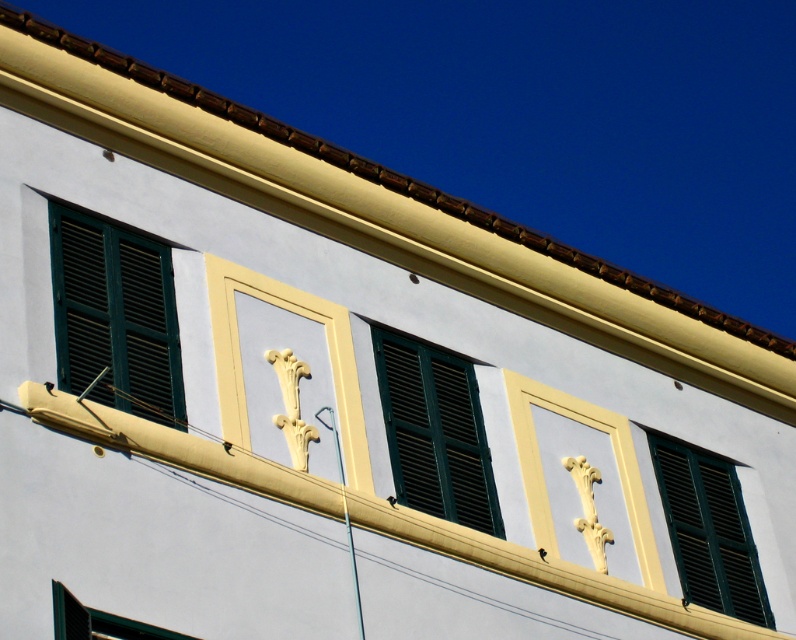
You are an architect designing a similar building facade. You have two green matte shutters at left and green matte shutters at center. Which one has a smaller width?

The green matte shutters at left has a smaller width than the green matte shutters at center.

You are standing in front of the building shown in the image. You want to know if you can reach the green matte shutters at center with a 30 meter long ladder. Can you do it?

The distance between you and the green matte shutters at center is 36.25 meters. Since the ladder is only 30 meters long, it is not long enough to reach the shutters.

You are standing in front of the building and notice a point marked at coordinates (115, 316). Based on the building facade described, can you identify which object this point is located on?

The point at (115, 316) is located on the green matte shutters at left.